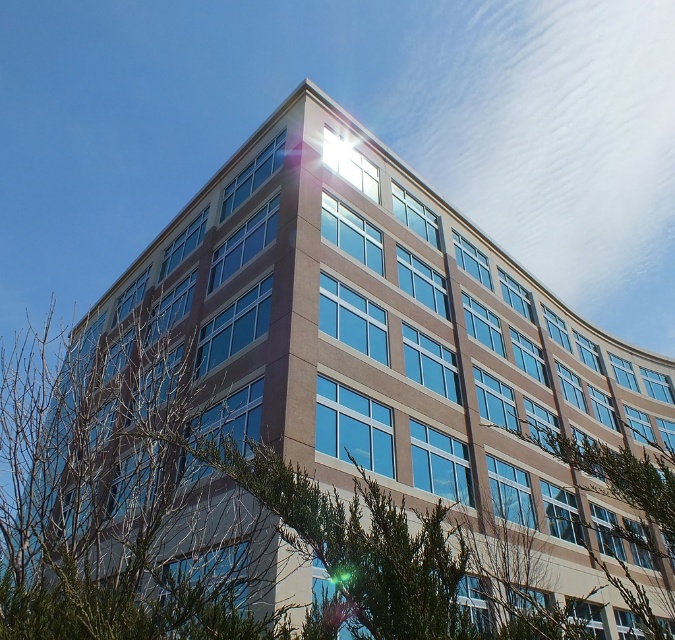
Can you confirm if green leafy tree at center is shorter than green leafy tree at lower right?

Yes.

Can you confirm if green leafy tree at center is positioned to the left of green leafy tree at lower right?

Yes, green leafy tree at center is to the left of green leafy tree at lower right.

Between point (142, 339) and point (649, 513), which one is positioned in front?

Point (649, 513) is more forward.

Where is `green leafy tree at center`? green leafy tree at center is located at coordinates (119, 499).